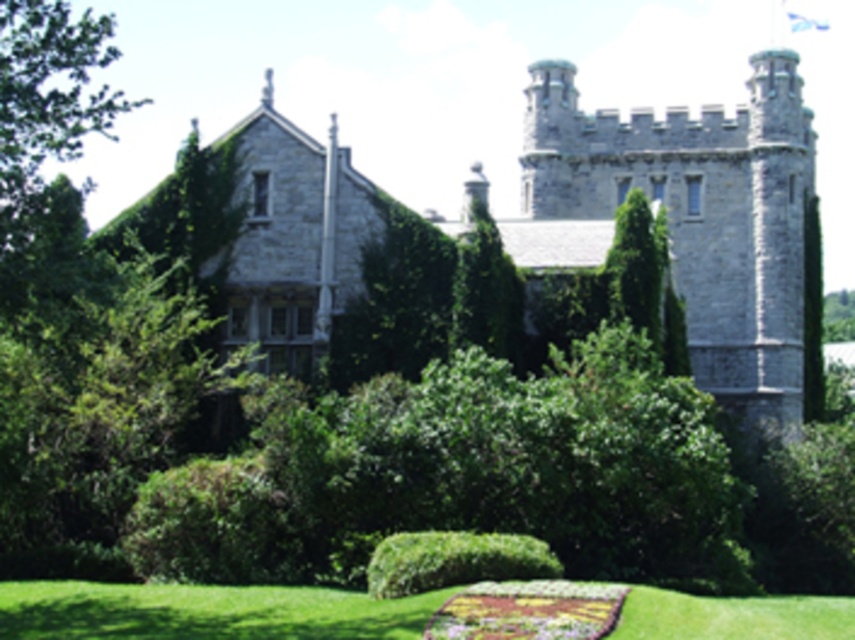
Question: Estimate the real-world distances between objects in this image. Which object is farther from the stone castle at center?

Choices:
 (A) multicolored fabric flower at lower center
 (B) green grass at lower center

Answer: (A)

Question: Does stone castle at center have a smaller size compared to green grass at lower center?

Choices:
 (A) yes
 (B) no

Answer: (B)

Question: Which point is closer to the camera?

Choices:
 (A) multicolored fabric flower at lower center
 (B) stone castle at center
 (C) green grass at lower center

Answer: (A)

Question: Can you confirm if stone castle at center is positioned below multicolored fabric flower at lower center?

Choices:
 (A) yes
 (B) no

Answer: (B)

Question: Which of the following is the farthest from the observer?

Choices:
 (A) stone castle at center
 (B) multicolored fabric flower at lower center
 (C) green grass at lower center

Answer: (A)

Question: Where is stone castle at center located in relation to green grass at lower center in the image?

Choices:
 (A) right
 (B) left

Answer: (A)